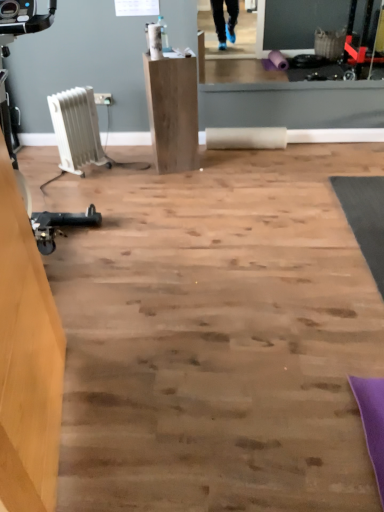
Question: Looking at the image, does wooden desk at left, the 1th furniture positioned from the bottom, seem bigger or smaller compared to natural wood pedestal at center, the 1th furniture viewed from the back?

Choices:
 (A) small
 (B) big

Answer: (B)

Question: From the image's perspective, is wooden desk at left, the second furniture positioned from the top, positioned above or below natural wood pedestal at center, acting as the 2th furniture starting from the front?

Choices:
 (A) above
 (B) below

Answer: (B)

Question: Based on their relative distances, which object is farther from the wooden desk at left, acting as the 1th furniture starting from the left?

Choices:
 (A) white plastic heater at left
 (B) white plastic radiator at left
 (C) natural wood pedestal at center, the 1th furniture viewed from the back

Answer: (B)

Question: Estimate the real-world distances between objects in this image. Which object is closer to the natural wood pedestal at center, acting as the 2th furniture starting from the front?

Choices:
 (A) white plastic radiator at left
 (B) wooden desk at left, arranged as the 1th furniture when viewed from the front
 (C) white plastic heater at left

Answer: (A)